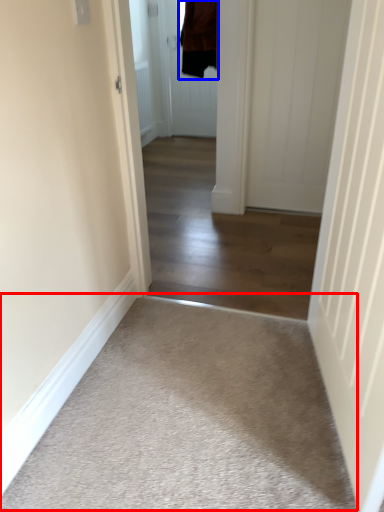
Question: Among these objects, which one is nearest to the camera, plain (highlighted by a red box) or jacket (highlighted by a blue box)?

Choices:
 (A) plain
 (B) jacket

Answer: (A)